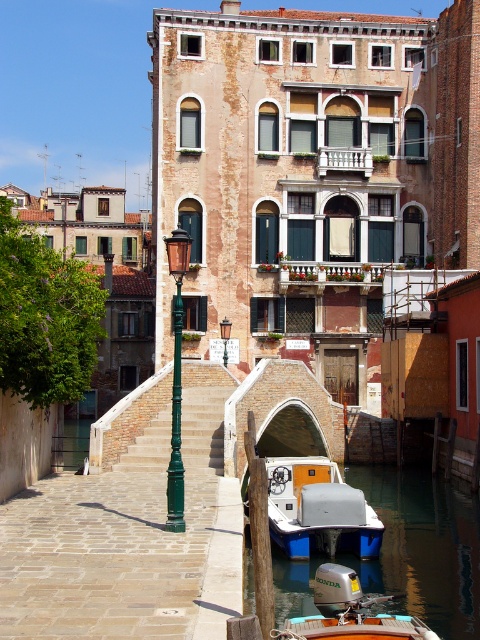
You are a tourist in Venice and want to take a photo of the blue plastic boat at lower center. Where should you position yourself to capture the boat in the center of your camera viewfinder?

To capture the blue plastic boat at lower center in the center of your camera viewfinder, position yourself directly in front of the boat at point (422, 547).

You are standing at the edge of the canal in Venice and see two points marked in the image. Which point, point [112,449] or point [224,346], is closer to you?

Point [112,449] is closer to you than point [224,346].

You are a tourist in Venice and want to take a photo of both the blue plastic boat at lower center and the green painted metal streetlamp at center. Can you fit both in your camera frame if the boat is shorter than the streetlamp?

The blue plastic boat at lower center is shorter than the green painted metal streetlamp at center, so yes, both can fit in the camera frame as the boat is smaller in height compared to the streetlamp.